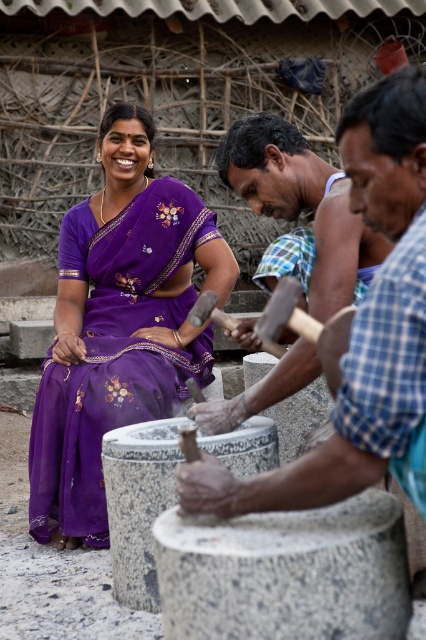
You are a photographer standing at the edge of the scene. You want to capture a closeup of both the purple silk saree at center and the smooth wooden hammer at center in the same frame. Given that your camera has a minimum focusing distance of 1 meter, will you be able to achieve this without moving closer?

The distance between the purple silk saree at center and the smooth wooden hammer at center is 93.53 centimeters. Since 93.53 cm is less than 1 meter, the camera cannot focus on both objects simultaneously at this distance. You would need to move closer to ensure both are within the minimum focusing range.

You are a photographer standing in front of the scene. You want to take a photo that includes both the purple silk saree at center and the smooth wooden hammer at center. Which object should you focus on first to ensure both are in clear view?

The purple silk saree at center is closer to you than the smooth wooden hammer at center, so you should focus on the purple silk saree at center first to ensure both are in clear view.